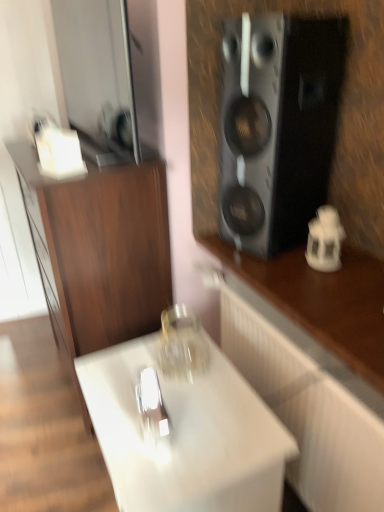
Question: Is black matte speaker at upper right thinner than transparent glass jar at center?

Choices:
 (A) no
 (B) yes

Answer: (A)

Question: Can you confirm if black matte speaker at upper right is bigger than transparent glass jar at center?

Choices:
 (A) no
 (B) yes

Answer: (B)

Question: From the image's perspective, is black matte speaker at upper right located above transparent glass jar at center?

Choices:
 (A) no
 (B) yes

Answer: (B)

Question: From the image's perspective, is black matte speaker at upper right located beneath transparent glass jar at center?

Choices:
 (A) yes
 (B) no

Answer: (B)

Question: Could you tell me if black matte speaker at upper right is turned towards transparent glass jar at center?

Choices:
 (A) no
 (B) yes

Answer: (B)

Question: Is wooden cabinet at left, which is counted as the 2th cabinetry, starting from the right, in front of or behind white porcelain lantern at right in the image?

Choices:
 (A) front
 (B) behind

Answer: (A)

Question: In terms of size, does wooden cabinet at left, which appears as the 1th cabinetry when viewed from the left, appear bigger or smaller than white porcelain lantern at right?

Choices:
 (A) small
 (B) big

Answer: (B)

Question: In terms of height, does wooden cabinet at left, which is counted as the 2th cabinetry, starting from the right, look taller or shorter compared to white porcelain lantern at right?

Choices:
 (A) short
 (B) tall

Answer: (B)

Question: Does point (157, 272) appear closer or farther from the camera than point (324, 266)?

Choices:
 (A) closer
 (B) farther

Answer: (B)

Question: Looking at their shapes, would you say white glossy cabinet at lower center, the 1th cabinetry in the right-to-left sequence, is wider or thinner than black matte speaker at upper right?

Choices:
 (A) thin
 (B) wide

Answer: (B)

Question: From a real-world perspective, relative to black matte speaker at upper right, is white glossy cabinet at lower center, marked as the second cabinetry in a left-to-right arrangement, vertically above or below?

Choices:
 (A) below
 (B) above

Answer: (A)

Question: Considering the relative positions of white glossy cabinet at lower center, marked as the second cabinetry in a left-to-right arrangement, and black matte speaker at upper right in the image provided, is white glossy cabinet at lower center, marked as the second cabinetry in a left-to-right arrangement, to the left or to the right of black matte speaker at upper right?

Choices:
 (A) right
 (B) left

Answer: (A)

Question: In the image, is white glossy cabinet at lower center, marked as the second cabinetry in a left-to-right arrangement, positioned in front of or behind black matte speaker at upper right?

Choices:
 (A) behind
 (B) front

Answer: (B)

Question: In terms of height, does white glossy table at center look taller or shorter compared to black matte speaker at upper right?

Choices:
 (A) tall
 (B) short

Answer: (B)

Question: From a real-world perspective, relative to black matte speaker at upper right, is white glossy table at center vertically above or below?

Choices:
 (A) below
 (B) above

Answer: (A)